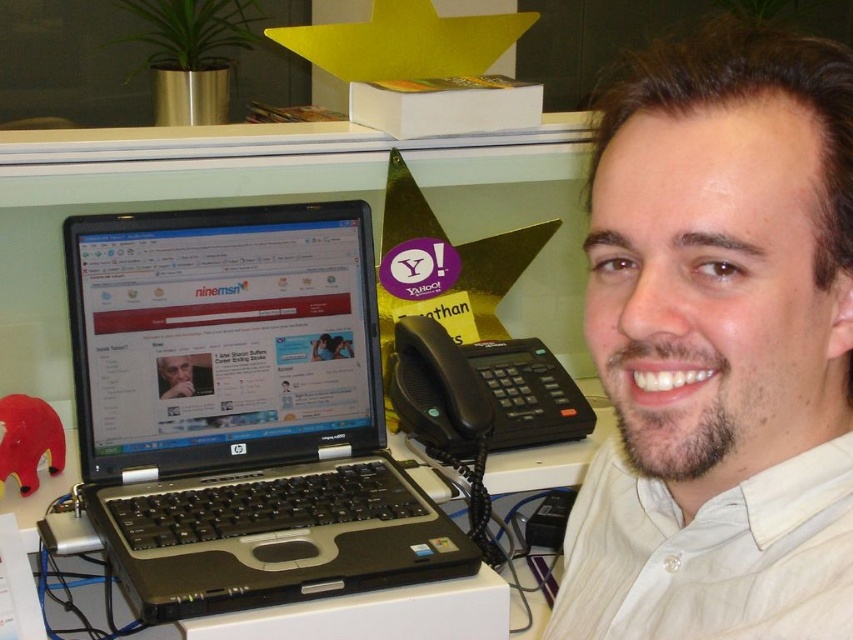
How distant is black plastic laptop at left from black plastic laptop at center?

black plastic laptop at left and black plastic laptop at center are 29.88 centimeters apart from each other.

Looking at this image, does black plastic laptop at left appear on the left side of black plastic laptop at center?

Correct, you'll find black plastic laptop at left to the left of black plastic laptop at center.

Between point (321, 580) and point (589, 442), which one is positioned in front?

Point (321, 580) is in front.

Identify the location of black plastic laptop at left. (241, 412).

Who is more forward, (682,513) or (505,465)?

Point (682,513) is in front.

Is white shirt at center to the right of black plastic laptop at center from the viewer's perspective?

Correct, you'll find white shirt at center to the right of black plastic laptop at center.

Is point (711, 116) closer to viewer compared to point (28, 524)?

Yes.

I want to click on white shirt at center, so [x=718, y=348].

Does black plastic laptop at left appear over black plastic telephone at center?

No, black plastic laptop at left is not above black plastic telephone at center.

Is black plastic laptop at left in front of black plastic telephone at center?

Yes, black plastic laptop at left is closer to the viewer.

Is point (225, 323) positioned after point (416, 394)?

No, it is in front of (416, 394).

Identify the location of black plastic laptop at left. (241, 412).